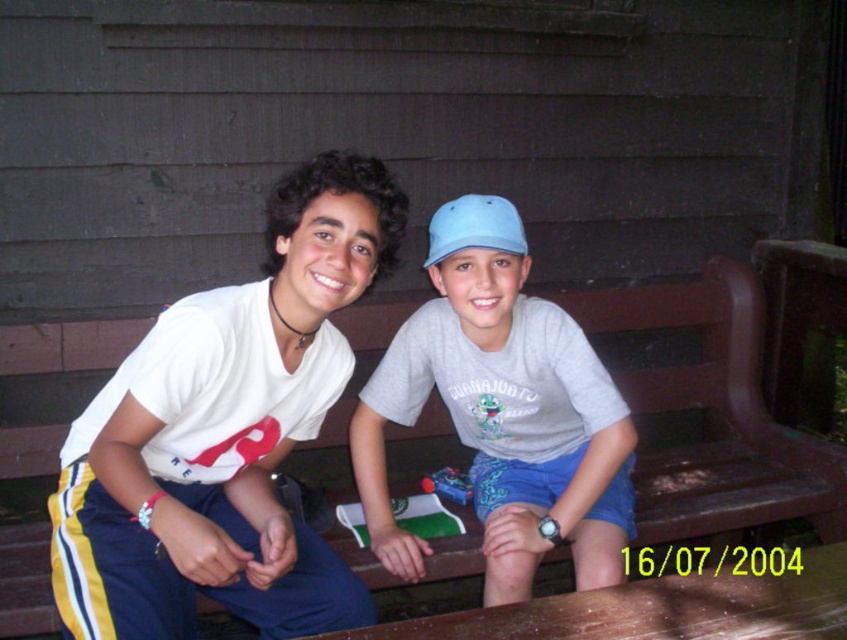
Between white matte t-shirt at center and gray cotton shirt at center, which one appears on the left side from the viewer's perspective?

white matte t-shirt at center

Can you confirm if white matte t-shirt at center is shorter than gray cotton shirt at center?

Incorrect, white matte t-shirt at center's height does not fall short of gray cotton shirt at center's.

Find the location of `white matte t-shirt at center`. white matte t-shirt at center is located at coordinates (225, 433).

In order to click on white matte t-shirt at center in this screenshot , I will do `click(225, 433)`.

Is brown wooden bench at center shorter than light blue fabric baseball cap at center?

No, brown wooden bench at center is not shorter than light blue fabric baseball cap at center.

Identify the location of brown wooden bench at center. (715, 413).

Measure the distance between brown wooden bench at center and camera.

brown wooden bench at center is 6.06 feet away from camera.

This screenshot has width=847, height=640. In order to click on brown wooden bench at center in this screenshot , I will do [x=715, y=413].

Between point (256, 454) and point (662, 532), which one is positioned in front?

Point (256, 454) is in front.

Can you confirm if white matte t-shirt at center is thinner than brown wooden bench at center?

Indeed, white matte t-shirt at center has a lesser width compared to brown wooden bench at center.

This screenshot has width=847, height=640. What do you see at coordinates (225, 433) in the screenshot?
I see `white matte t-shirt at center` at bounding box center [225, 433].

You are a GUI agent. You are given a task and a screenshot of the screen. Output one action in this format:
    pyautogui.click(x=<x>, y=<y>)
    Task: Click on the white matte t-shirt at center
    This screenshot has height=640, width=847.
    Given the screenshot: What is the action you would take?
    pyautogui.click(x=225, y=433)